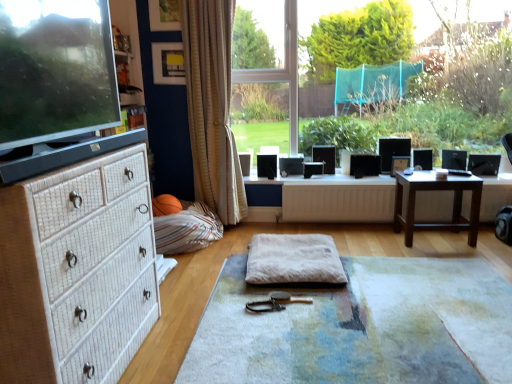
Question: Is beige textured yoga mat at center, the 2th yoga mat when ordered from top to bottom, to the left or to the right of transparent glass window at center in the image?

Choices:
 (A) left
 (B) right

Answer: (A)

Question: Is beige textured yoga mat at center, the 2th yoga mat when ordered from top to bottom, spatially inside transparent glass window at center, or outside of it?

Choices:
 (A) inside
 (B) outside

Answer: (B)

Question: Which object is the farthest from the beige textured yoga mat at center, the 1th yoga mat in the bottom-to-top sequence?

Choices:
 (A) beige striped curtain at center
 (B) matte black monitor at left
 (C) brown wooden table at right
 (D) transparent glass window at center
 (E) striped fabric bean bag at lower left

Answer: (D)

Question: Estimate the real-world distances between objects in this image. Which object is closer to the beige textured yoga mat at center, the 1th yoga mat in the bottom-to-top sequence?

Choices:
 (A) white fluffy yoga mat at center, placed as the second yoga mat when sorted from bottom to top
 (B) matte black monitor at left
 (C) white wicker chest of drawers at left
 (D) transparent glass window at center
 (E) matte wooden picture frame at upper center

Answer: (A)